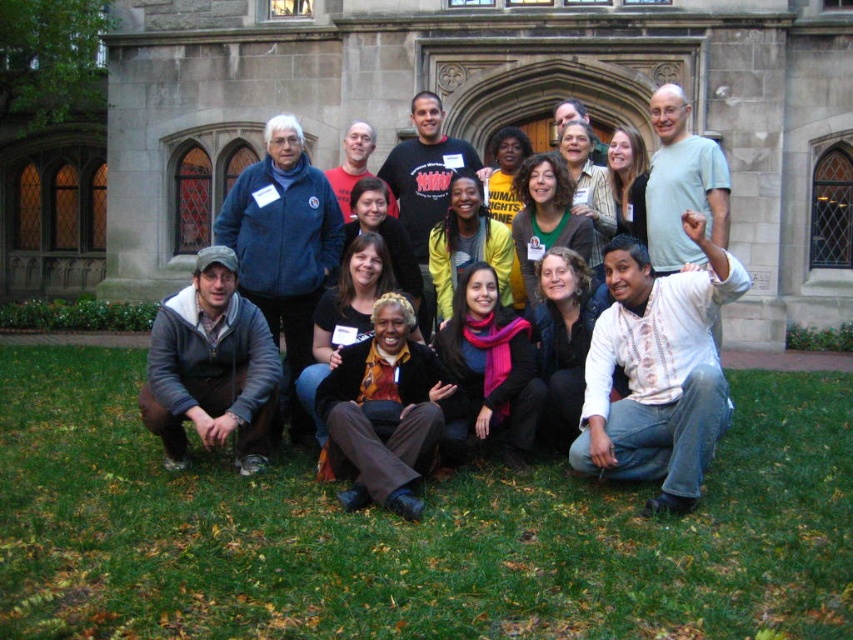
Question: Does green grass at lower center have a smaller size compared to matte blue jacket at lower left?

Choices:
 (A) yes
 (B) no

Answer: (A)

Question: Is yellow fabric shirt at center behind matte black t-shirt at center?

Choices:
 (A) yes
 (B) no

Answer: (B)

Question: Which of these objects is positioned closest to the matte black t-shirt at center?

Choices:
 (A) matte blue jacket at lower left
 (B) green grass at lower center
 (C) brown textured pants at center

Answer: (A)

Question: Among these points, which one is nearest to the camera?

Choices:
 (A) (456, 244)
 (B) (403, 362)
 (C) (242, 276)

Answer: (B)

Question: Which of the following is the closest to the observer?

Choices:
 (A) (160, 305)
 (B) (357, 129)

Answer: (B)

Question: Does matte blue jacket at lower left come in front of matte black t-shirt at center?

Choices:
 (A) yes
 (B) no

Answer: (A)